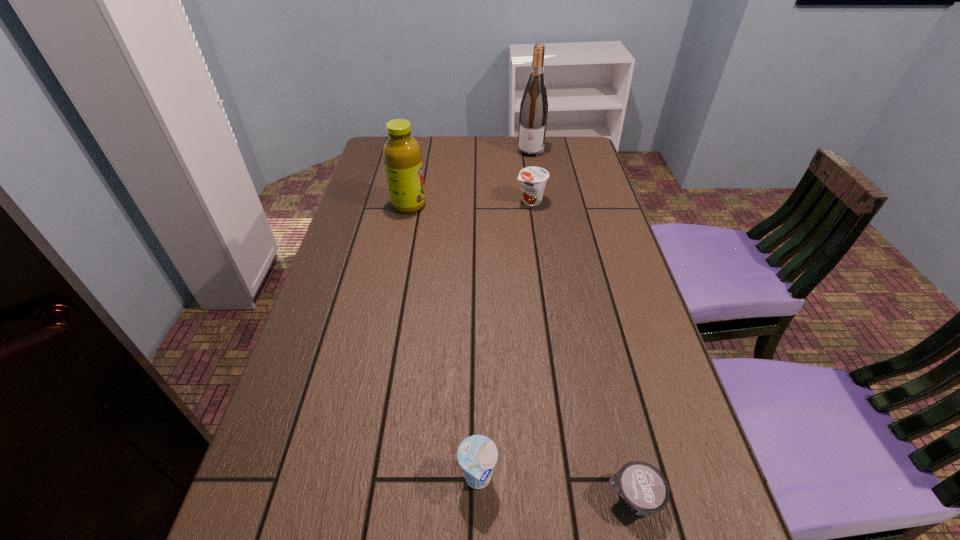
Identify the location of free spot located on the left of the second yogurt from right to left. Image resolution: width=960 pixels, height=540 pixels. tap(417, 201).

Find the location of a particular element. The width and height of the screenshot is (960, 540). free space located on the right of the fourth object from right to left is located at coordinates (554, 478).

Identify the location of free space located 0.090m on the right of the rightmost yogurt. (713, 497).

This screenshot has height=540, width=960. What are the coordinates of `object that is at the far edge` in the screenshot? It's located at (534, 105).

Find the location of `object at the left edge`. object at the left edge is located at coordinates (402, 155).

Where is `object that is at the right edge`? This screenshot has height=540, width=960. object that is at the right edge is located at coordinates (642, 489).

The image size is (960, 540). Find the location of `vacant space at the far edge`. vacant space at the far edge is located at coordinates (486, 169).

Where is `vacant space at the left edge of the desktop`? Image resolution: width=960 pixels, height=540 pixels. vacant space at the left edge of the desktop is located at coordinates (364, 234).

The width and height of the screenshot is (960, 540). Find the location of `vacant space at the right edge of the desktop`. vacant space at the right edge of the desktop is located at coordinates (595, 214).

The height and width of the screenshot is (540, 960). Find the location of `blank region between the leftmost object and the farthest yogurt`. blank region between the leftmost object and the farthest yogurt is located at coordinates (469, 203).